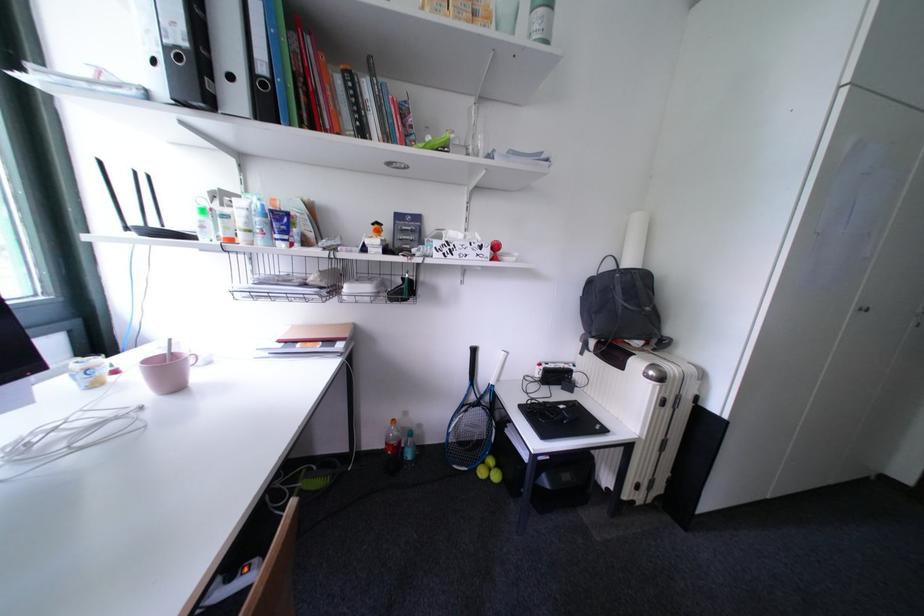
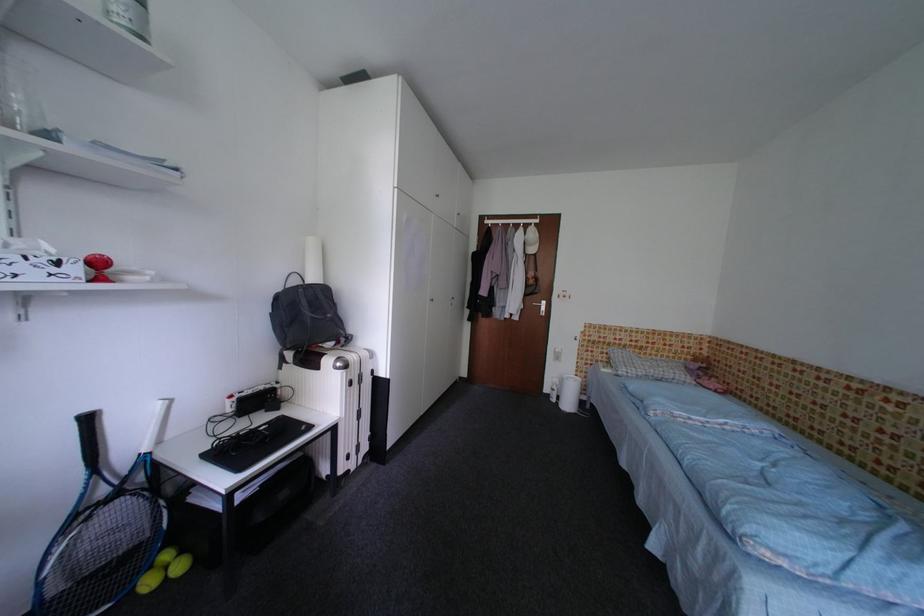
The point at [482,353] is marked in the first image. Where is the corresponding point in the second image?

(98, 422)